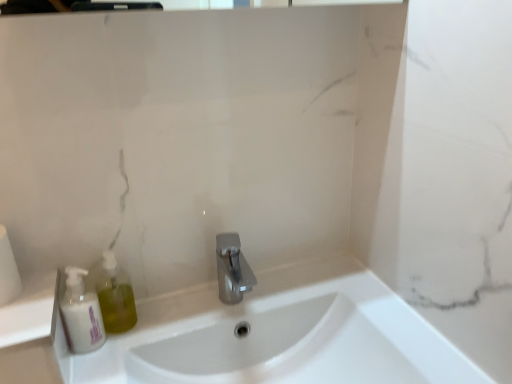
I want to click on free space between white matte bottle at left and polished metallic faucet at center, so click(x=163, y=319).